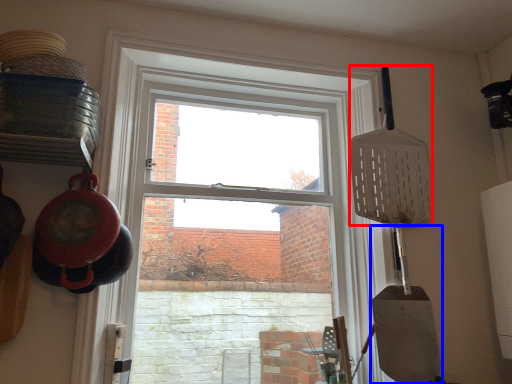
Question: Which point is closer to the camera, spatula (highlighted by a red box) or shovel (highlighted by a blue box)?

Choices:
 (A) spatula
 (B) shovel

Answer: (B)